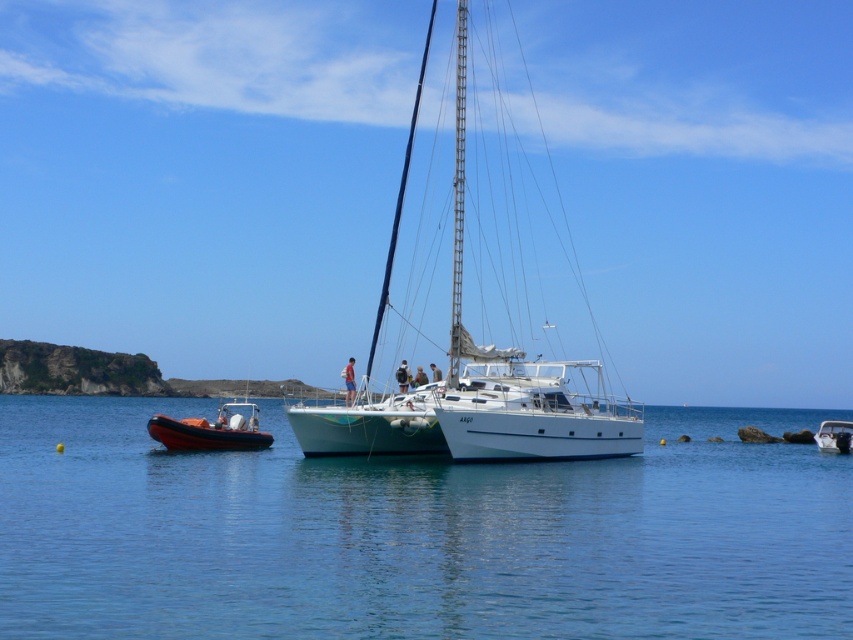
Question: Is white glossy sailboat at center further to camera compared to orange rubber dinghy at left?

Choices:
 (A) no
 (B) yes

Answer: (A)

Question: Which object is farther from the camera taking this photo?

Choices:
 (A) orange rubber dinghy at left
 (B) white glossy boat at center
 (C) white glossy sailboat at center
 (D) clear blue water at center

Answer: (B)

Question: Is clear blue water at center above white glossy boat at center?

Choices:
 (A) yes
 (B) no

Answer: (A)

Question: In this image, where is white glossy sailboat at center located relative to white glossy boat at center?

Choices:
 (A) above
 (B) below

Answer: (A)

Question: Among these objects, which one is farthest from the camera?

Choices:
 (A) white glossy boat at center
 (B) orange rubber dinghy at left
 (C) clear blue water at center

Answer: (A)

Question: Which object is positioned farthest from the white glossy sailboat at center?

Choices:
 (A) orange rubber dinghy at left
 (B) clear blue water at center

Answer: (A)